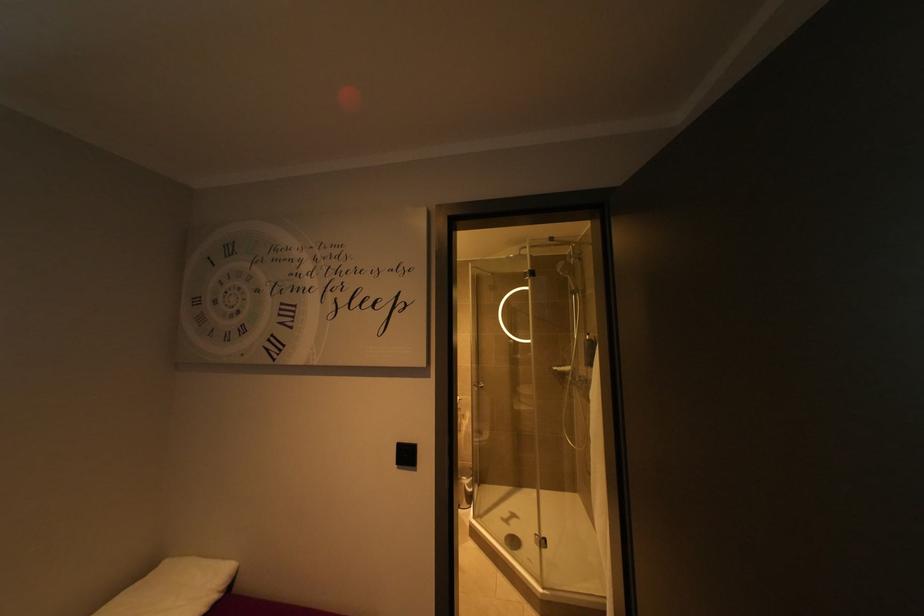
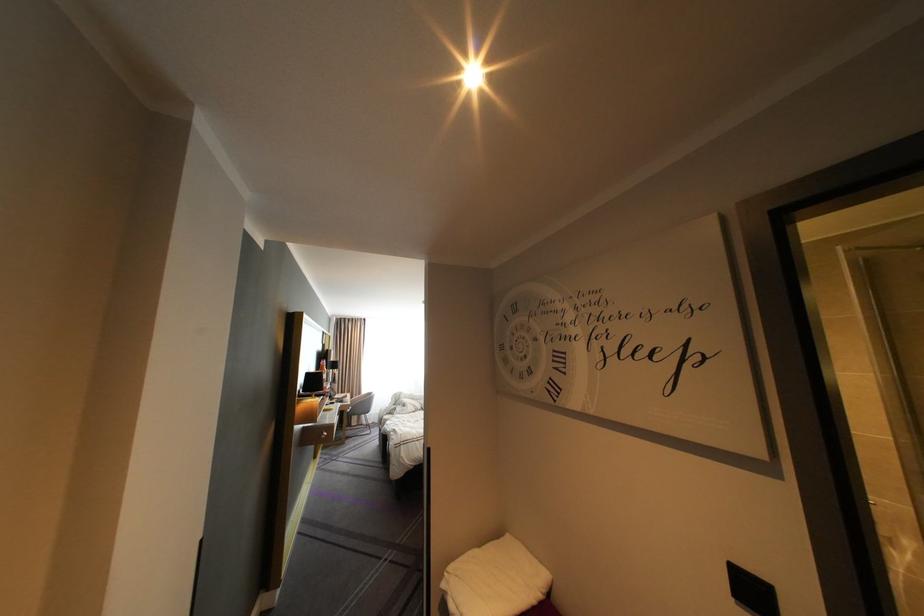
Find the pixel in the second image that matches (x=409, y=469) in the first image.

(748, 604)